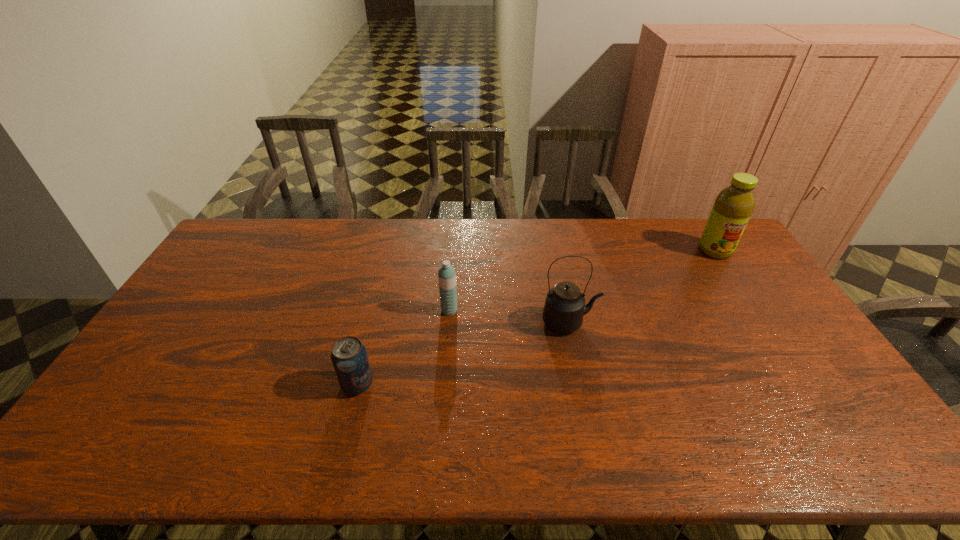
Find the location of a particular element. Image resolution: width=960 pixels, height=540 pixels. vacant space that's between the second shortest object and the fruit juice is located at coordinates (582, 281).

What are the coordinates of `free spot between the leftmost object and the second object from left to right` in the screenshot? It's located at (403, 347).

The width and height of the screenshot is (960, 540). Find the location of `vacant area that lies between the third object from left to right and the leftmost object`. vacant area that lies between the third object from left to right and the leftmost object is located at coordinates (464, 353).

You are a GUI agent. You are given a task and a screenshot of the screen. Output one action in this format:
    pyautogui.click(x=<x>, y=<y>)
    Task: Click on the empty space between the fruit juice and the third object from left to right
    
    Given the screenshot: What is the action you would take?
    pyautogui.click(x=642, y=287)

The width and height of the screenshot is (960, 540). I want to click on vacant area between the shortest object and the rightmost object, so click(537, 318).

At what (x,y) coordinates should I click in order to perform the action: click on empty space between the water bottle and the second object from right to left. Please return your answer as a coordinate pair (x, y). Looking at the image, I should click on (510, 316).

Where is `empty space that is in between the second object from left to right and the pop soda`? Image resolution: width=960 pixels, height=540 pixels. empty space that is in between the second object from left to right and the pop soda is located at coordinates (403, 347).

Identify the location of empty space that is in between the pop soda and the kettle. This screenshot has height=540, width=960. (464, 353).

At what (x,y) coordinates should I click in order to perform the action: click on empty space that is in between the pop soda and the kettle. Please return your answer as a coordinate pair (x, y). Looking at the image, I should click on (464, 353).

Locate an element on the screen. object that stands as the closest to the kettle is located at coordinates (446, 275).